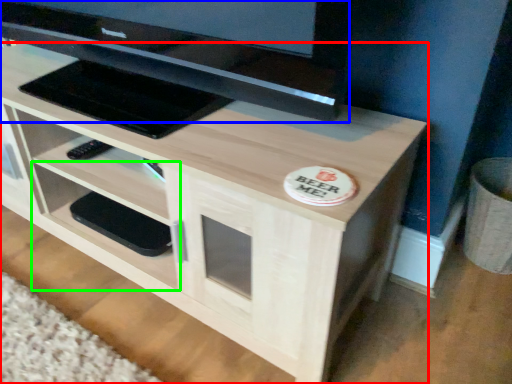
Question: Which object is positioned farthest from desk (highlighted by a red box)? Select from television (highlighted by a blue box) and shelf (highlighted by a green box).

Choices:
 (A) television
 (B) shelf

Answer: (A)